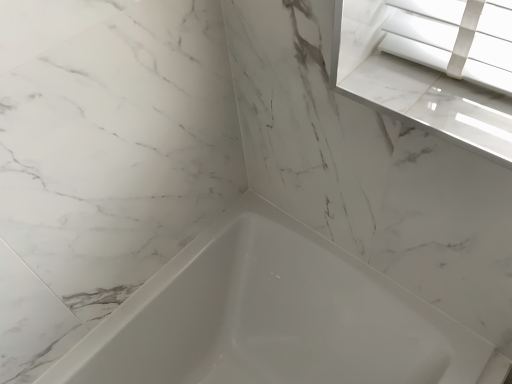
Describe the element at coordinates (272, 317) in the screenshot. This screenshot has height=384, width=512. I see `white glossy bathtub at center` at that location.

The image size is (512, 384). What are the coordinates of `white glossy bathtub at center` in the screenshot? It's located at (272, 317).

The height and width of the screenshot is (384, 512). Identify the location of white glossy bathtub at center. (272, 317).